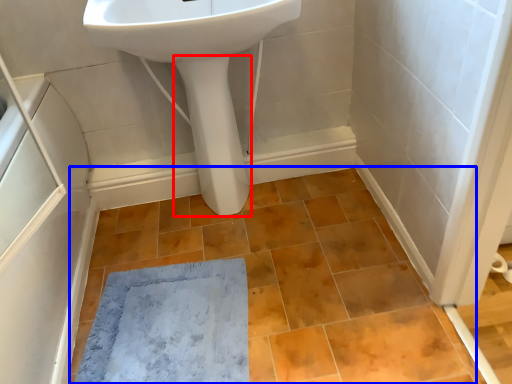
Question: Which of the following is the farthest to the observer, bidet (highlighted by a red box) or ceramic tile (highlighted by a blue box)?

Choices:
 (A) bidet
 (B) ceramic tile

Answer: (A)